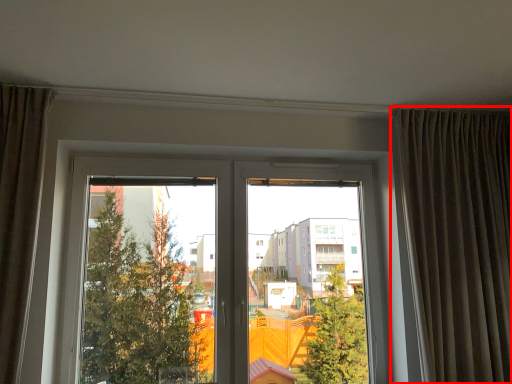
Question: From the image, what is the correct spatial relationship of curtain (annotated by the red box) in relation to window?

Choices:
 (A) left
 (B) right

Answer: (B)